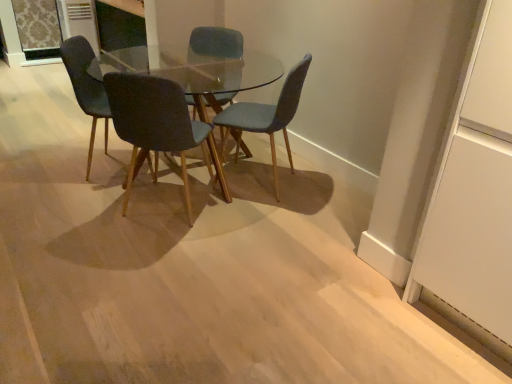
The width and height of the screenshot is (512, 384). I want to click on vacant area that lies in front of matte blue chair at center, which is the first chair in left-to-right order, so click(80, 200).